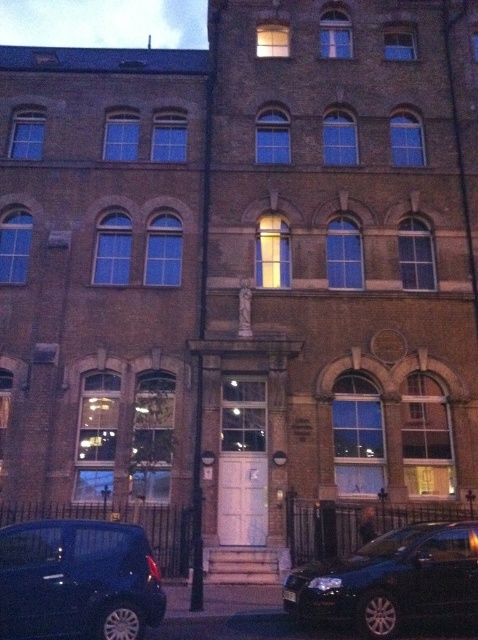
You are a delivery person who needs to park your vehicle between the shiny blue car at lower left and the black metallic car at lower right. Your delivery van is 2 meters wide. Can you fit your van between them?

The shiny blue car at lower left is narrower than the black metallic car at lower right, but the exact distance between them isn

You are a pedestrian standing in front of the building and want to cross the street. You see the shiny blue car at lower left and the black metallic car at lower right. Which car is closer to the central entrance of the building?

The shiny blue car at lower left is closer to the central entrance of the building because it is positioned over the black metallic car at lower right, indicating it is in front.